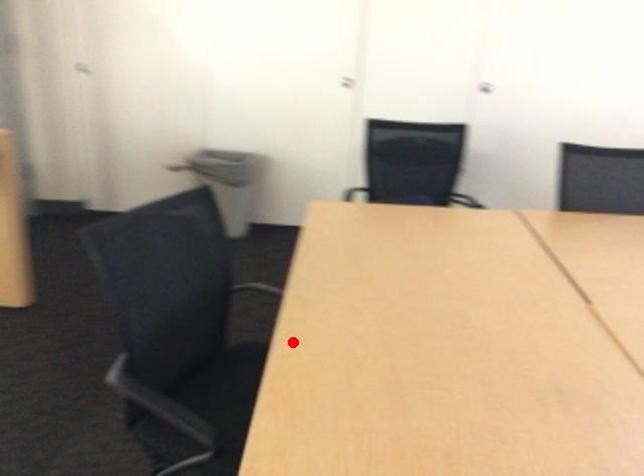
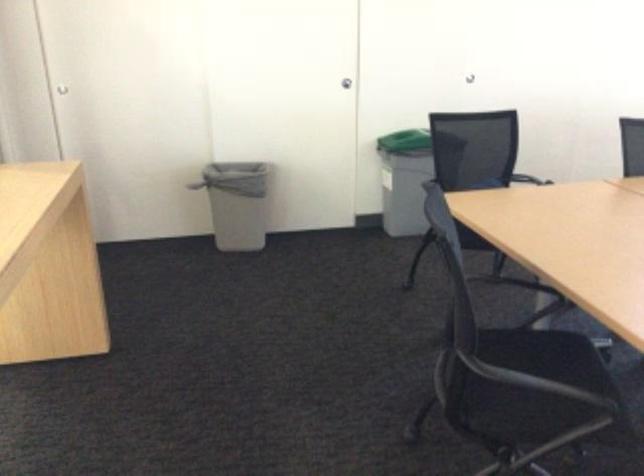
Question: I am providing you with two images of the same scene from different viewpoints. Image1 has a red point marked. In image2, the corresponding 3D location appears at what relative position? Reply with the corresponding letter.

Choices:
 (A) Closer
 (B) Farther

Answer: (B)